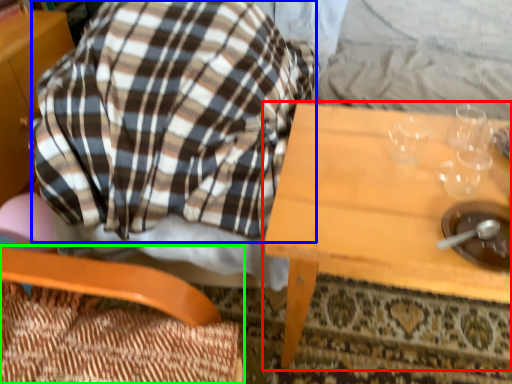
Question: Which object is positioned closest to table (highlighted by a red box)? Select from flannel (highlighted by a blue box) and chair (highlighted by a green box).

Choices:
 (A) flannel
 (B) chair

Answer: (A)